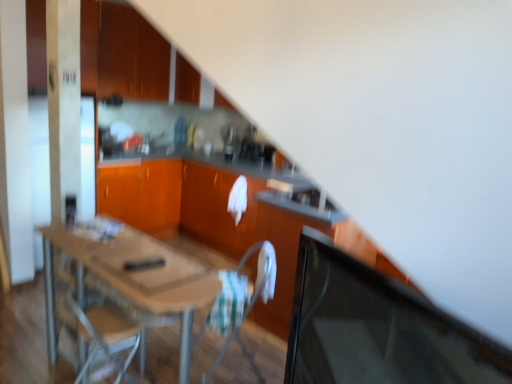
Question: Looking at their shapes, would you say matte wood cabinets at upper left, positioned as the 2th cabinetry in bottom-to-top order, is wider or thinner than wooden table at center?

Choices:
 (A) thin
 (B) wide

Answer: (A)

Question: From the image's perspective, is matte wood cabinets at upper left, acting as the 1th cabinetry starting from the top, located above or below wooden table at center?

Choices:
 (A) above
 (B) below

Answer: (A)

Question: Estimate the real-world distances between objects in this image. Which object is closer to the wooden table at center?

Choices:
 (A) orange glossy cabinets at center, which ranks as the second cabinetry in top-to-bottom order
 (B) white fabric chair at center
 (C) black glossy computer monitor at right
 (D) matte wood cabinets at upper left, acting as the 1th cabinetry starting from the top
 (E) wooden table at center

Answer: (A)

Question: Considering the real-world distances, which object is closest to the matte wood cabinets at upper left, acting as the 1th cabinetry starting from the top?

Choices:
 (A) wooden table at center
 (B) black glossy computer monitor at right
 (C) orange glossy cabinets at center, which appears as the first cabinetry when ordered from the bottom
 (D) white fabric chair at center
 (E) wooden table at center

Answer: (A)